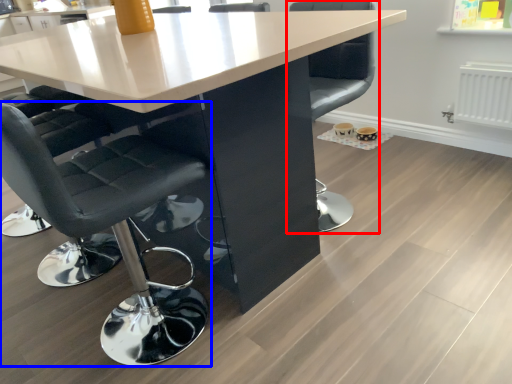
Question: Which object appears farthest to the camera in this image, chair (highlighted by a red box) or chair (highlighted by a blue box)?

Choices:
 (A) chair
 (B) chair

Answer: (A)